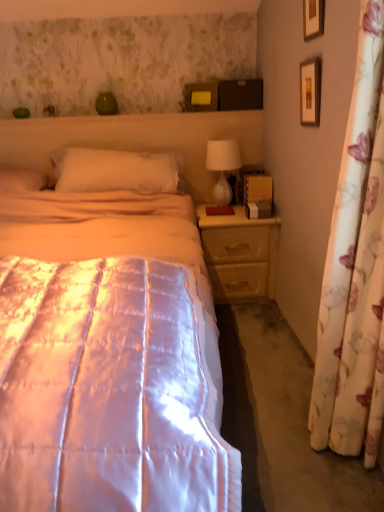
You are a GUI agent. You are given a task and a screenshot of the screen. Output one action in this format:
    pyautogui.click(x=<x>, y=<y>)
    Task: Click on the white glossy table lamp at upper right
    The width and height of the screenshot is (384, 512).
    Given the screenshot: What is the action you would take?
    pyautogui.click(x=223, y=166)

Measure the distance between point (318,73) and camera.

Point (318,73) is 1.80 meters from camera.

Where is `silky white quilt at center`? The image size is (384, 512). silky white quilt at center is located at coordinates (108, 355).

Looking at this image, what is the approximate height of white soft pillow at center?

white soft pillow at center is 36.61 centimeters tall.

The width and height of the screenshot is (384, 512). Describe the element at coordinates (115, 170) in the screenshot. I see `white soft pillow at center` at that location.

What do you see at coordinates (355, 270) in the screenshot? I see `floral fabric curtain at right` at bounding box center [355, 270].

The width and height of the screenshot is (384, 512). Identify the location of white glossy table lamp at upper right. (223, 166).

In terms of size, does floral fabric curtain at right appear bigger or smaller than white glossy table lamp at upper right?

In the image, floral fabric curtain at right appears to be larger than white glossy table lamp at upper right.

Considering the positions of objects floral fabric curtain at right and white glossy table lamp at upper right in the image provided, who is behind, floral fabric curtain at right or white glossy table lamp at upper right?

white glossy table lamp at upper right is more distant.

From the image's perspective, would you say floral fabric curtain at right is positioned over white glossy table lamp at upper right?

No.

Can you tell me how much floral fabric curtain at right and white glossy table lamp at upper right differ in facing direction?

They differ by 89.7 degrees in their facing directions.

Relative to light wood/texture nightstand at right, is wooden picture frame at upper right, the second picture frame when ordered from top to bottom, in front or behind?

Clearly, wooden picture frame at upper right, the second picture frame when ordered from top to bottom, is in front of light wood/texture nightstand at right.

Would you say wooden picture frame at upper right, the first picture frame in the bottom-to-top sequence, is inside or outside light wood/texture nightstand at right?

wooden picture frame at upper right, the first picture frame in the bottom-to-top sequence, lies outside light wood/texture nightstand at right.

Does wooden picture frame at upper right, the second picture frame when ordered from top to bottom, touch light wood/texture nightstand at right?

No, wooden picture frame at upper right, the second picture frame when ordered from top to bottom, is not with light wood/texture nightstand at right.

From a real-world perspective, does wooden picture frame at upper right, the second picture frame when ordered from top to bottom, stand above light wood/texture nightstand at right?

Yes.

How distant is white glossy table lamp at upper right from silky white quilt at center?

white glossy table lamp at upper right is 36.29 inches from silky white quilt at center.

Who is taller, white glossy table lamp at upper right or silky white quilt at center?

Standing taller between the two is silky white quilt at center.

Which point is more distant from viewer, (225, 153) or (88, 196)?

The point (225, 153) is farther.

This screenshot has width=384, height=512. I want to click on the 2nd picture frame positioned above the light wood/texture nightstand at right (from a real-world perspective), so click(x=313, y=18).

Between light wood/texture nightstand at right and wooden picture frame at upper right, marked as the 1th picture frame in a top-to-bottom arrangement, which one appears on the right side from the viewer's perspective?

From the viewer's perspective, wooden picture frame at upper right, marked as the 1th picture frame in a top-to-bottom arrangement, appears more on the right side.

Considering the relative sizes of light wood/texture nightstand at right and wooden picture frame at upper right, acting as the second picture frame starting from the bottom, in the image provided, is light wood/texture nightstand at right taller than wooden picture frame at upper right, acting as the second picture frame starting from the bottom,?

Indeed, light wood/texture nightstand at right has a greater height compared to wooden picture frame at upper right, acting as the second picture frame starting from the bottom.

Is point (207, 259) positioned behind point (61, 188)?

Yes, point (207, 259) is farther from viewer.

Is light wood/texture nightstand at right oriented away from white soft pillow at center?

No, white soft pillow at center is not at the back of light wood/texture nightstand at right.

Looking at this image, from a real-world perspective, is light wood/texture nightstand at right positioned above or below white soft pillow at center?

light wood/texture nightstand at right is below white soft pillow at center.

Which of these two, light wood/texture nightstand at right or white soft pillow at center, is smaller?

With smaller size is white soft pillow at center.

Is silky white quilt at center far from light wood/texture nightstand at right?

silky white quilt at center is actually quite close to light wood/texture nightstand at right.

From a real-world perspective, is silky white quilt at center physically located above or below light wood/texture nightstand at right?

From a real-world perspective, silky white quilt at center is physically above light wood/texture nightstand at right.

What's the angular difference between silky white quilt at center and light wood/texture nightstand at right's facing directions?

The facing directions of silky white quilt at center and light wood/texture nightstand at right are 1.71e-05 degrees apart.

The image size is (384, 512). Identify the location of nightstand above the silky white quilt at center (from the image's perspective). pos(240,254).

From a real-world perspective, is white soft pillow at center above or below white glossy table lamp at upper right?

Clearly, from a real-world perspective, white soft pillow at center is above white glossy table lamp at upper right.

In terms of size, does white soft pillow at center appear bigger or smaller than white glossy table lamp at upper right?

Clearly, white soft pillow at center is larger in size than white glossy table lamp at upper right.

Looking at this image, would you say white soft pillow at center is outside white glossy table lamp at upper right?

Yes, white soft pillow at center is located beyond the bounds of white glossy table lamp at upper right.

Does point (56, 154) come farther from viewer compared to point (232, 154)?

Yes, it is.

Where is `curtain below the white glossy table lamp at upper right (from the image's perspective)`? Image resolution: width=384 pixels, height=512 pixels. curtain below the white glossy table lamp at upper right (from the image's perspective) is located at coordinates (355, 270).

You are a GUI agent. You are given a task and a screenshot of the screen. Output one action in this format:
    pyautogui.click(x=<x>, y=<y>)
    Task: Click on the 2nd picture frame to the right of the light wood/texture nightstand at right, counting from the anchor's position
    The image size is (384, 512).
    Given the screenshot: What is the action you would take?
    pyautogui.click(x=310, y=91)

From the picture: Considering their positions, is silky white quilt at center positioned further to white glossy table lamp at upper right than white soft pillow at center?

silky white quilt at center lies further to white glossy table lamp at upper right than the other object.

Which object lies nearer to the anchor point wooden picture frame at upper right, marked as the 1th picture frame in a top-to-bottom arrangement, wooden picture frame at upper right, the first picture frame in the bottom-to-top sequence, or white soft pillow at center?

wooden picture frame at upper right, the first picture frame in the bottom-to-top sequence, lies closer to wooden picture frame at upper right, marked as the 1th picture frame in a top-to-bottom arrangement, than the other object.

Which object lies nearer to the anchor point wooden picture frame at upper right, the first picture frame in the bottom-to-top sequence, light wood/texture nightstand at right or white soft pillow at center?

light wood/texture nightstand at right is positioned closer to the anchor wooden picture frame at upper right, the first picture frame in the bottom-to-top sequence.

Looking at the image, which one is located closer to floral fabric curtain at right, silky white quilt at center or light wood/texture nightstand at right?

Based on the image, silky white quilt at center appears to be nearer to floral fabric curtain at right.

Which object lies further to the anchor point white soft pillow at center, floral fabric curtain at right or wooden picture frame at upper right, acting as the second picture frame starting from the bottom?

floral fabric curtain at right is positioned further to the anchor white soft pillow at center.

Which object lies nearer to the anchor point white soft pillow at center, silky white quilt at center or floral fabric curtain at right?

Among the two, silky white quilt at center is located nearer to white soft pillow at center.

Based on their spatial positions, is white soft pillow at center or white glossy table lamp at upper right further from light wood/texture nightstand at right?

Among the two, white soft pillow at center is located further to light wood/texture nightstand at right.

When comparing their distances from wooden picture frame at upper right, the second picture frame when ordered from top to bottom, does white soft pillow at center or white glossy table lamp at upper right seem further?

white soft pillow at center lies further to wooden picture frame at upper right, the second picture frame when ordered from top to bottom, than the other object.

This screenshot has width=384, height=512. In order to click on table lamp between white soft pillow at center and wooden picture frame at upper right, the first picture frame in the bottom-to-top sequence in this screenshot , I will do `click(223, 166)`.

Locate an element on the screen. picture frame between white soft pillow at center and wooden picture frame at upper right, the second picture frame when ordered from top to bottom, from left to right is located at coordinates (313, 18).

At what (x,y) coordinates should I click in order to perform the action: click on picture frame positioned between wooden picture frame at upper right, marked as the 1th picture frame in a top-to-bottom arrangement, and white glossy table lamp at upper right from near to far. Please return your answer as a coordinate pair (x, y). Looking at the image, I should click on pyautogui.click(x=310, y=91).

Where is `pillow between wooden picture frame at upper right, marked as the 1th picture frame in a top-to-bottom arrangement, and light wood/texture nightstand at right in the up-down direction`? The image size is (384, 512). pillow between wooden picture frame at upper right, marked as the 1th picture frame in a top-to-bottom arrangement, and light wood/texture nightstand at right in the up-down direction is located at coordinates (115, 170).